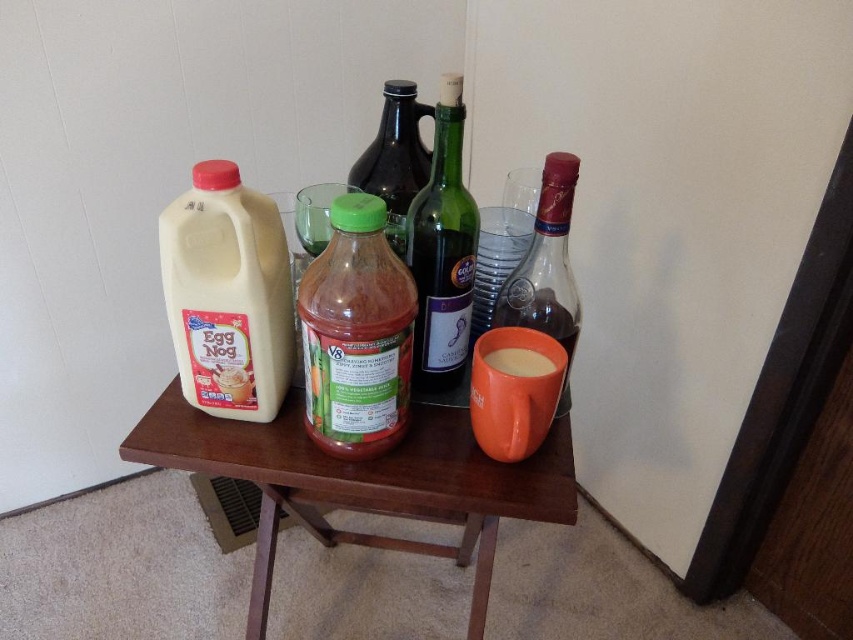
You are standing in the room and want to pick up the white matte jug at left from the wooden table at center. Which object do you need to move closer to first?

You need to move closer to the wooden table at center first because it is closer to you than the white matte jug at left, which is further away.

You are standing in front of the table and want to reach the two points on the table. Which point, point (375, 362) or point (242, 384), is closer to you?

Point (375, 362) is closer to you than point (242, 384).

You are trying to place a book on the wooden table at center. The book is as tall as the white matte jug at left. Will the book fit vertically on the table without falling off?

The wooden table at center is taller than the white matte jug at left. Since the book is as tall as the jug, it will fit vertically on the table without falling off because the table is higher than the jug.